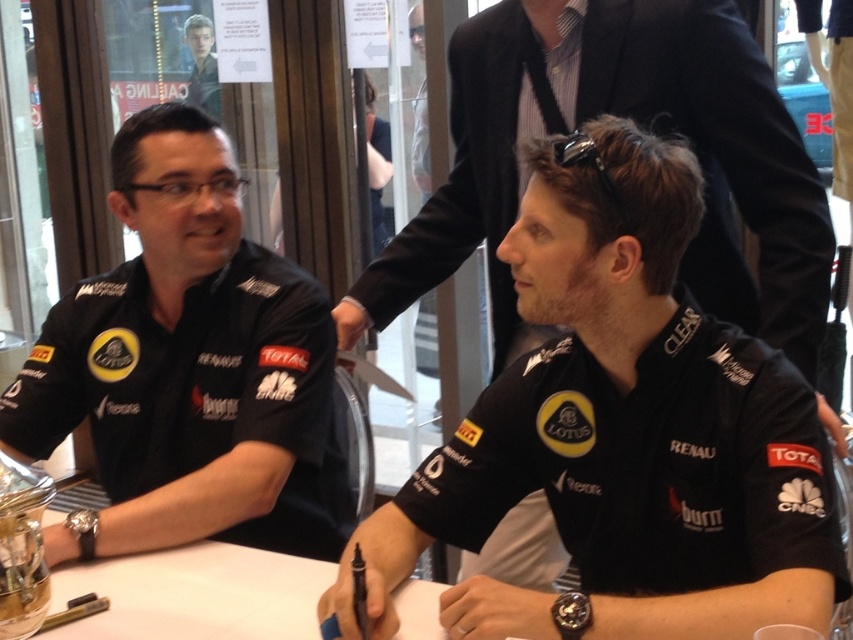
You are a photographer at a press conference. You need to capture a photo where both the black matte shirt at center and the black matte shirt at left are clearly visible. The camera lens has a maximum focus range of 20 inches. Will you be able to focus on both shirts simultaneously?

The black matte shirt at center and black matte shirt at left are 20.80 inches apart from each other. Since the distance between them exceeds the camera lens maximum focus range of 20 inches, the photographer will not be able to focus on both shirts simultaneously.

You are a photographer at a press conference. You need to capture a photo where the black matte shirt at left and the white glossy table at center are both clearly visible. Since the lighting is uneven, which object should you adjust your camera focus on first to ensure both are in frame?

The black matte shirt at left is to the left of white glossy table at center, so you should focus on the black matte shirt at left first to ensure both are in frame.